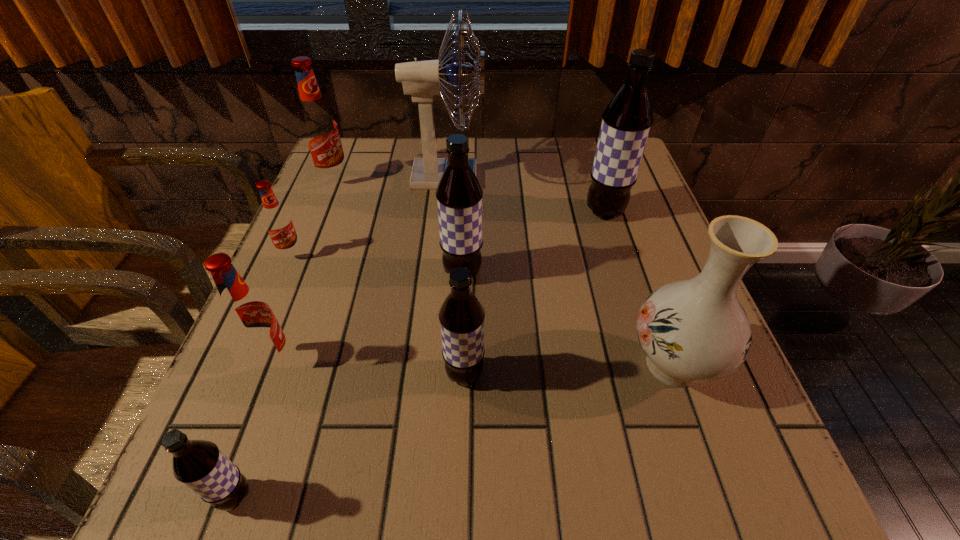
Where is `vacant space located on the right of the nearest root beer`? vacant space located on the right of the nearest root beer is located at coordinates (443, 496).

Locate an element on the screen. This screenshot has height=540, width=960. fan that is at the far edge is located at coordinates (422, 80).

The width and height of the screenshot is (960, 540). Identify the location of root beer situated at the far edge. (319, 128).

This screenshot has height=540, width=960. What are the coordinates of `object present at the near edge` in the screenshot? It's located at (199, 464).

Identify the location of root beer that is at the right edge. This screenshot has height=540, width=960. (626, 122).

This screenshot has height=540, width=960. In order to click on vase present at the right edge in this screenshot , I will do (x=695, y=330).

Find the location of a particular element. The width and height of the screenshot is (960, 540). object present at the far left corner is located at coordinates (319, 128).

Locate an element on the screen. This screenshot has width=960, height=540. object that is at the near left corner is located at coordinates (199, 464).

The width and height of the screenshot is (960, 540). Identify the location of vacant area at the far edge of the desktop. (557, 172).

The image size is (960, 540). I want to click on free space at the near edge of the desktop, so click(x=655, y=511).